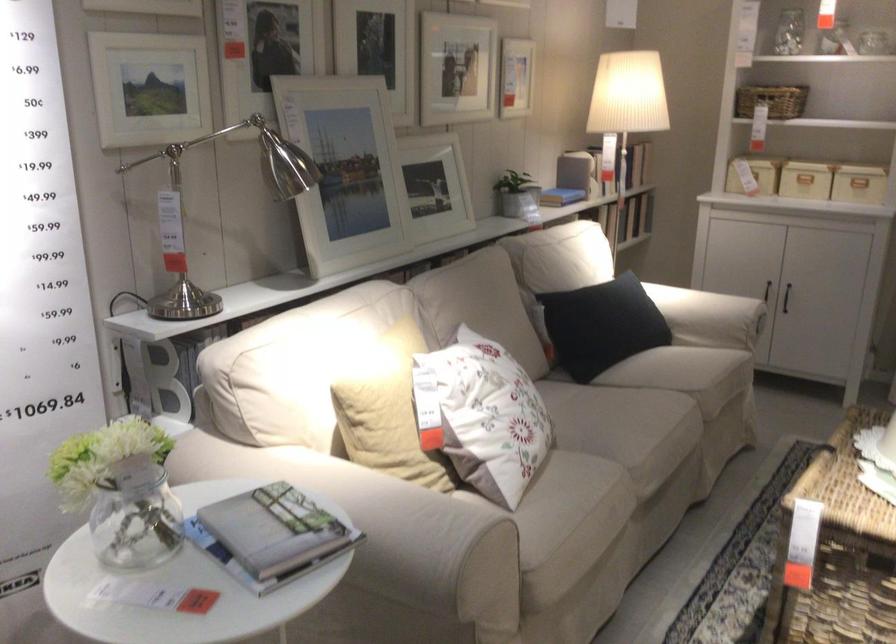
Where is `hardcover book`? This screenshot has width=896, height=644. hardcover book is located at coordinates click(270, 536).